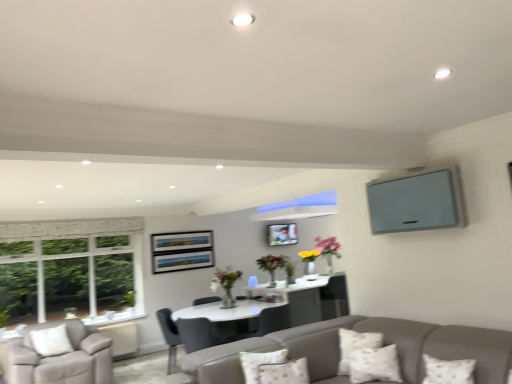
Question: Relative to matte gray tv at upper right, is white textured pillow at lower right, arranged as the 2th pillow when viewed from the left, in front or behind?

Choices:
 (A) behind
 (B) front

Answer: (B)

Question: In the image, is white textured pillow at lower right, placed as the second pillow when sorted from right to left, on the left side or the right side of matte gray tv at upper right?

Choices:
 (A) right
 (B) left

Answer: (B)

Question: Estimate the real-world distances between objects in this image. Which object is closer to the white textured pillow at lower center, which is the third pillow from left to right?

Choices:
 (A) white textured pillow at lower right, placed as the second pillow when sorted from right to left
 (B) metallic silver picture frame at center
 (C) matte gray tv at upper right
 (D) light gray fabric armchair at lower left, the 1th chair from the left
 (E) fluffy white pillow at lower center, placed as the third pillow when sorted from right to left

Answer: (A)

Question: Estimate the real-world distances between objects in this image. Which object is farther from the matte gray chair at center, arranged as the 2th chair when viewed from the left?

Choices:
 (A) metallic silver picture frame at center
 (B) light gray fabric armchair at lower left, the 2th chair in the right-to-left sequence
 (C) matte gray tv at upper right
 (D) white textured pillow at lower right, placed as the second pillow when sorted from right to left
 (E) fluffy white pillow at lower center, placed as the third pillow when sorted from right to left

Answer: (C)